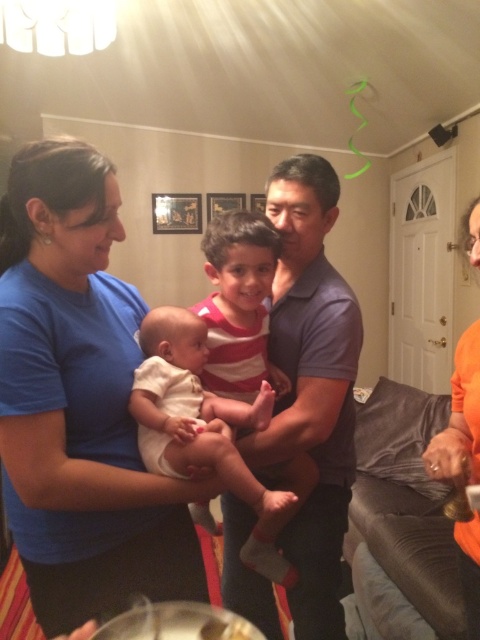
Question: Which object is farther from the camera taking this photo?

Choices:
 (A) dark blue shirt at center
 (B) orange cotton shirt at right
 (C) white soft baby at center
 (D) blue fabric shirt at left

Answer: (A)

Question: Estimate the real-world distances between objects in this image. Which object is closer to the dark blue shirt at center?

Choices:
 (A) orange cotton shirt at right
 (B) blue fabric shirt at left
 (C) striped fabric shirt at center

Answer: (C)

Question: Does striped fabric shirt at center appear on the left side of white soft baby at center?

Choices:
 (A) no
 (B) yes

Answer: (A)

Question: Can you confirm if blue fabric shirt at left is positioned to the right of dark blue shirt at center?

Choices:
 (A) no
 (B) yes

Answer: (A)

Question: Can you confirm if blue fabric shirt at left is smaller than white soft baby at center?

Choices:
 (A) no
 (B) yes

Answer: (A)

Question: Which point is closer to the camera?

Choices:
 (A) (320, 349)
 (B) (171, 308)
 (C) (471, 525)
 (D) (37, 196)

Answer: (D)